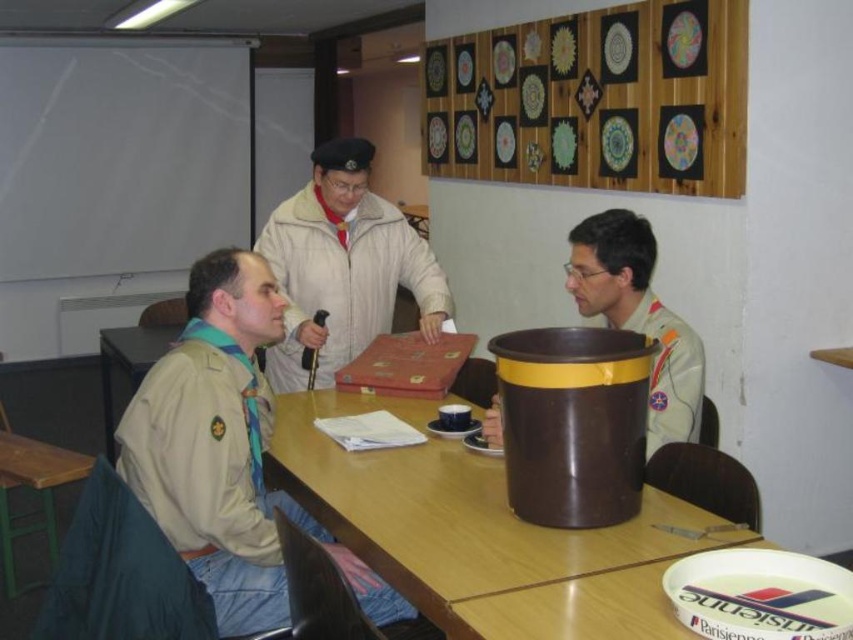
Where is `beige uniform at left`? The width and height of the screenshot is (853, 640). beige uniform at left is located at coordinates (225, 452).

Is beige uniform at left smaller than brown matte trash can at right?

No, beige uniform at left is not smaller than brown matte trash can at right.

Between point (129, 454) and point (596, 259), which one is positioned behind?

The point (596, 259) is behind.

The height and width of the screenshot is (640, 853). I want to click on beige uniform at left, so (x=225, y=452).

Does brown matte trash can at right have a larger size compared to wooden table at lower left?

No, brown matte trash can at right is not bigger than wooden table at lower left.

Does brown matte trash can at right have a greater height compared to wooden table at lower left?

Yes, brown matte trash can at right is taller than wooden table at lower left.

Is point (701, 342) positioned before point (49, 465)?

Yes.

Locate an element on the screen. The width and height of the screenshot is (853, 640). brown matte trash can at right is located at coordinates pyautogui.click(x=637, y=316).

Is brown plastic bucket at center further to the viewer compared to brown matte trash can at right?

No, brown plastic bucket at center is in front of brown matte trash can at right.

Is brown plastic bucket at center above brown matte trash can at right?

Actually, brown plastic bucket at center is below brown matte trash can at right.

Is point (560, 605) in front of point (622, 323)?

Yes, point (560, 605) is closer to viewer.

Where is `brown plastic bucket at center`? This screenshot has width=853, height=640. brown plastic bucket at center is located at coordinates (480, 532).